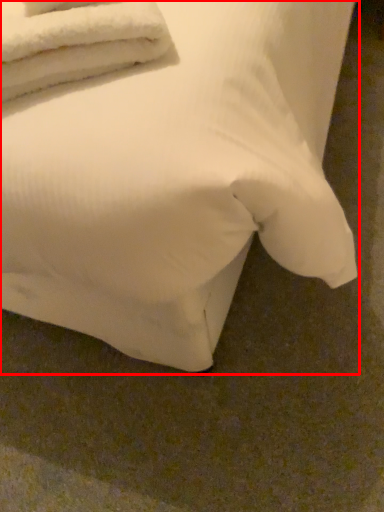
Question: From the image's perspective, where is bed (annotated by the red box) located relative to towel?

Choices:
 (A) above
 (B) below

Answer: (A)